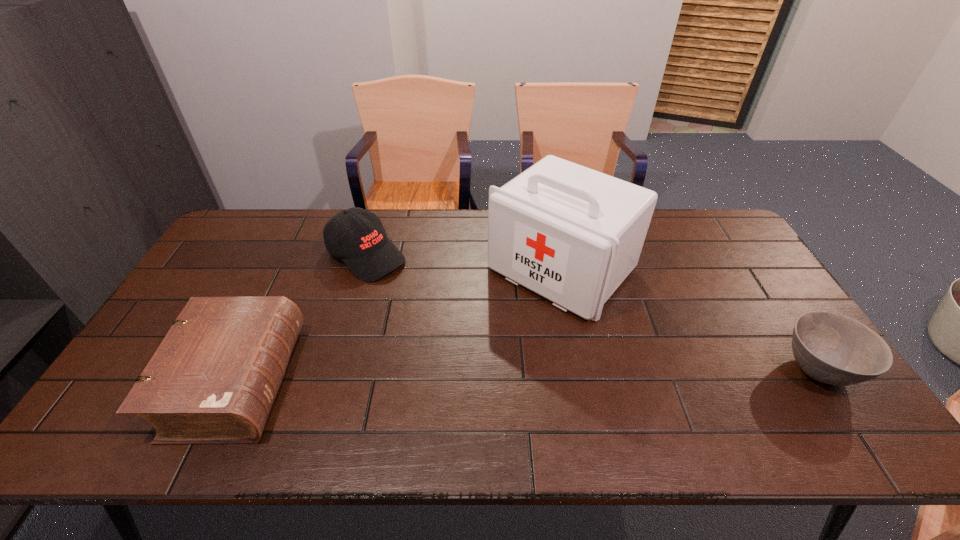
Image resolution: width=960 pixels, height=540 pixels. I want to click on free region located 0.160m on the front-facing side of the baseball cap, so click(x=427, y=298).

At what (x,y) coordinates should I click in order to perform the action: click on vacant space located on the front-facing side of the tallest object. Please return your answer as a coordinate pair (x, y). Looking at the image, I should click on (502, 328).

At what (x,y) coordinates should I click in order to perform the action: click on vacant point located 0.090m on the front-facing side of the tallest object. Please return your answer as a coordinate pair (x, y). Looking at the image, I should click on (500, 330).

Where is `free space located 0.200m on the front-facing side of the tallest object`? free space located 0.200m on the front-facing side of the tallest object is located at coordinates pos(474,355).

The width and height of the screenshot is (960, 540). I want to click on baseball cap positioned at the far edge, so click(357, 236).

I want to click on the first-aid kit that is at the far edge, so click(x=571, y=234).

Identify the location of Bible at the near edge. (213, 380).

Find the location of `bowl situated at the near edge`. bowl situated at the near edge is located at coordinates (831, 348).

This screenshot has width=960, height=540. What are the coordinates of `object at the left edge` in the screenshot? It's located at (213, 380).

Where is `object situated at the right edge`? object situated at the right edge is located at coordinates (831, 348).